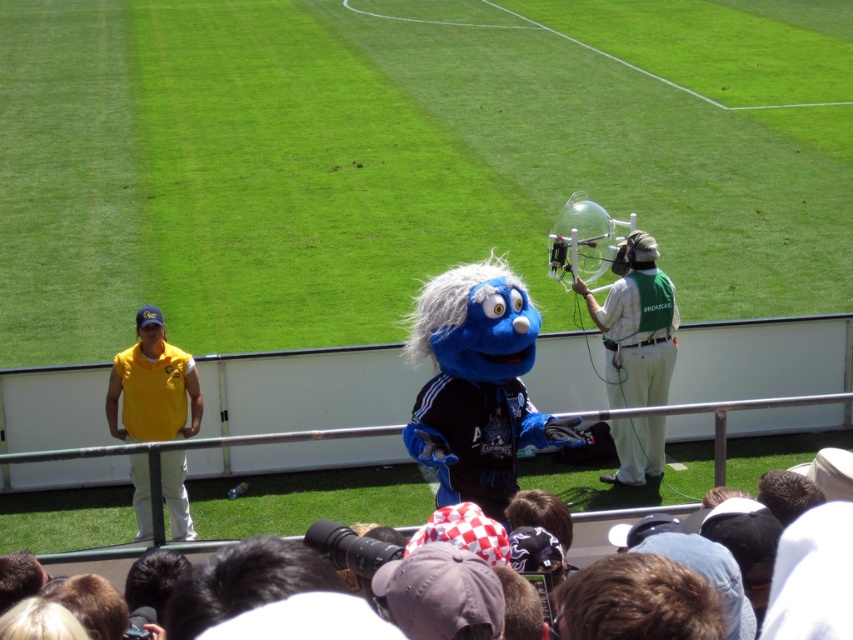
Between green fabric microphone at right and yellow fabric shirt at left, which one has less height?

Standing shorter between the two is yellow fabric shirt at left.

Is green fabric microphone at right bigger than yellow fabric shirt at left?

Yes, green fabric microphone at right is bigger than yellow fabric shirt at left.

Identify the location of green fabric microphone at right. (636, 324).